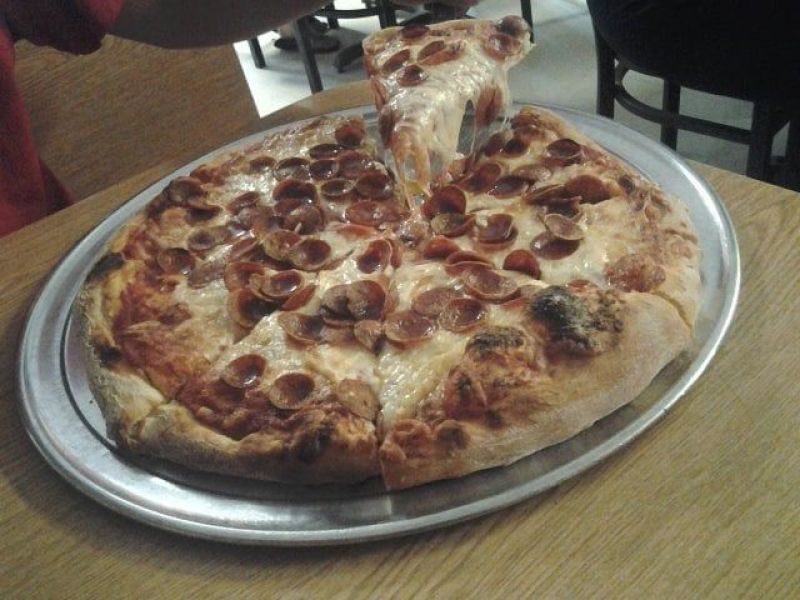
Identify the location of chair legs. This screenshot has width=800, height=600. (606, 96), (758, 145), (672, 94).